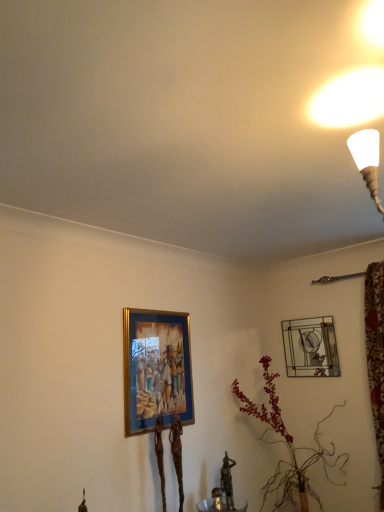
Question: Is gold-framed painting at lower left, which is the first picture frame in left-to-right order, inside the boundaries of metallic glass picture frame at upper right, the first picture frame positioned from the right, or outside?

Choices:
 (A) inside
 (B) outside

Answer: (B)

Question: From a real-world perspective, is gold-framed painting at lower left, the first picture frame from the front, positioned above or below metallic glass picture frame at upper right, the 2th picture frame when ordered from front to back?

Choices:
 (A) above
 (B) below

Answer: (B)

Question: Which object is the farthest from the metallic glass picture frame at upper right, which is counted as the 1th picture frame, starting from the back?

Choices:
 (A) gold-framed painting at lower left, the 2th picture frame in the right-to-left sequence
 (B) leather-like plant at center-right

Answer: (A)

Question: Which of these objects is positioned closest to the leather-like plant at center-right?

Choices:
 (A) gold-framed painting at lower left, which is the first picture frame in left-to-right order
 (B) metallic glass picture frame at upper right, acting as the second picture frame starting from the left

Answer: (B)